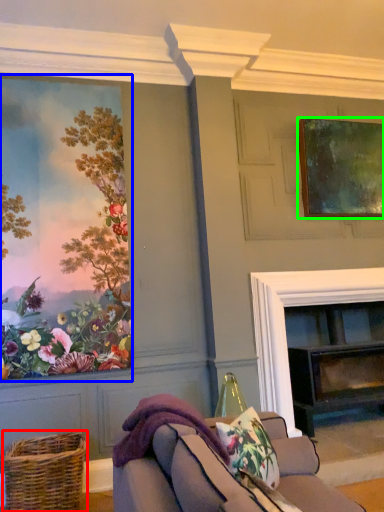
Question: Which is nearer to the basket (highlighted by a red box)? picture frame (highlighted by a blue box) or picture frame (highlighted by a green box).

Choices:
 (A) picture frame
 (B) picture frame

Answer: (A)